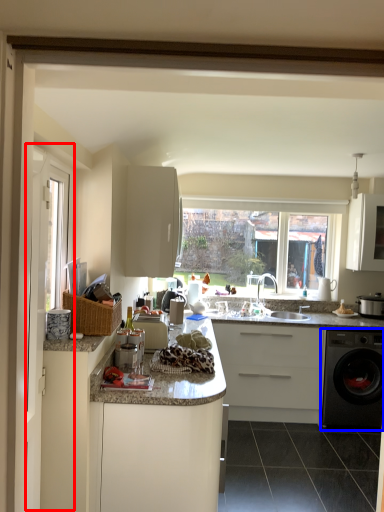
Question: Among these objects, which one is farthest to the camera, screen door (highlighted by a red box) or washing machine (highlighted by a blue box)?

Choices:
 (A) screen door
 (B) washing machine

Answer: (B)